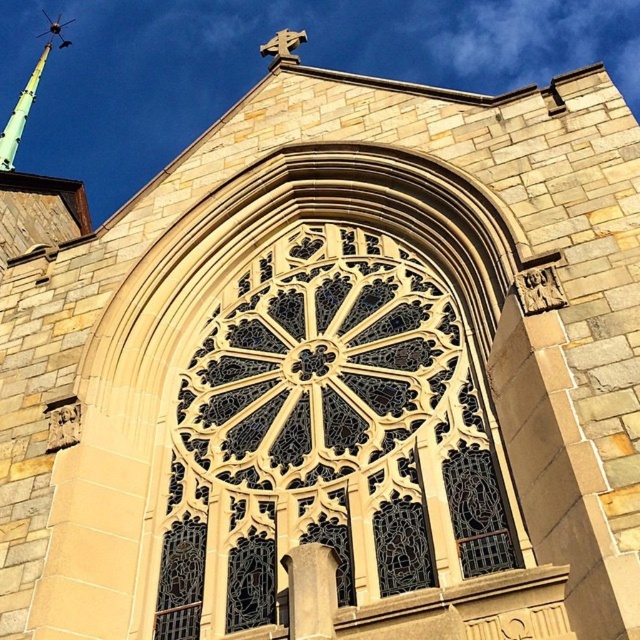
Does point (236, 605) come behind point (0, 141)?

No, it is in front of (0, 141).

Measure the distance between stained glass window at center and green glass spire at upper left.

The distance of stained glass window at center from green glass spire at upper left is 387.56 feet.

Does point (225, 438) lie in front of point (65, 38)?

Yes, point (225, 438) is closer to viewer.

This screenshot has width=640, height=640. I want to click on stained glass window at center, so (x=328, y=436).